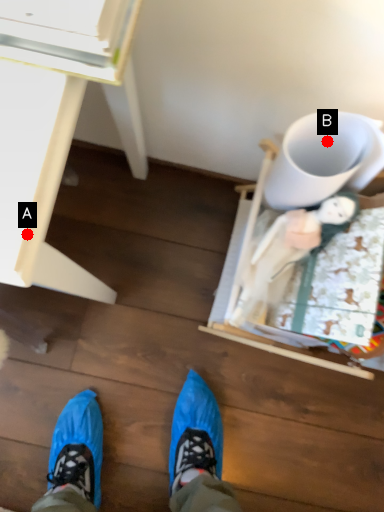
Question: Two points are circled on the image, labeled by A and B beside each circle. Which of the following is the farthest from the observer?

Choices:
 (A) A is further
 (B) B is further

Answer: (B)